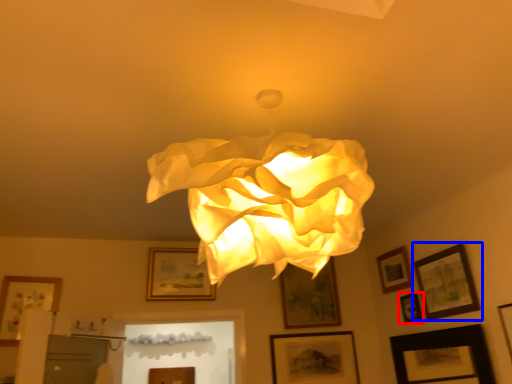
Question: Among these objects, which one is farthest to the camera, picture frame (highlighted by a red box) or picture frame (highlighted by a blue box)?

Choices:
 (A) picture frame
 (B) picture frame

Answer: (A)